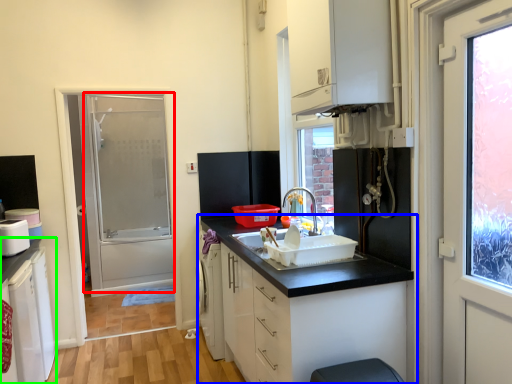
Question: Which is nearer to the screen door (highlighted by a red box)? cabinetry (highlighted by a blue box) or cabinetry (highlighted by a green box).

Choices:
 (A) cabinetry
 (B) cabinetry

Answer: (B)